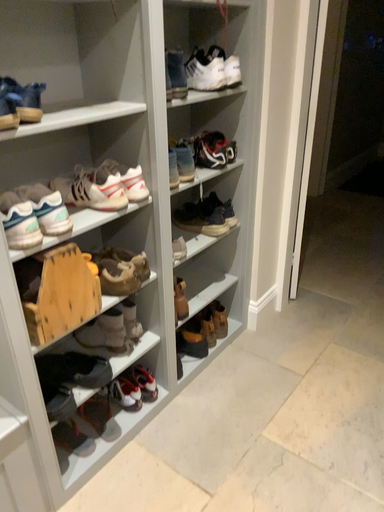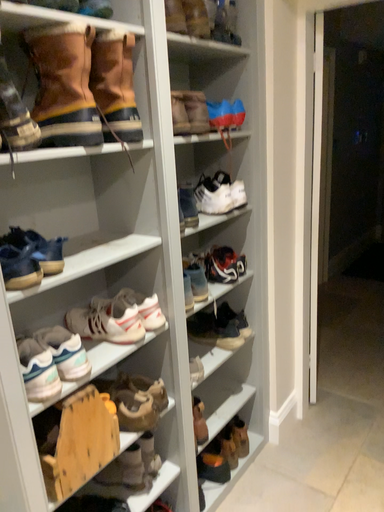
Question: How did the camera likely rotate when shooting the video?

Choices:
 (A) rotated downward
 (B) rotated upward

Answer: (B)